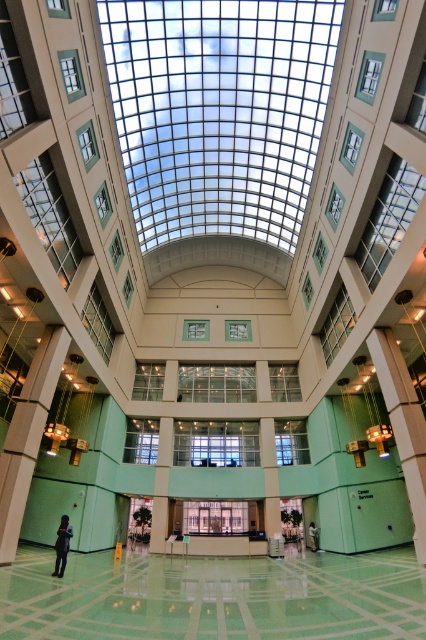
Question: Which of the following is the closest to the observer?

Choices:
 (A) (55, 541)
 (B) (313, 536)
 (C) (40, 552)

Answer: (C)

Question: Is green polished concrete floor at lower center to the right of light brown leather jacket at lower center from the viewer's perspective?

Choices:
 (A) yes
 (B) no

Answer: (B)

Question: Among these points, which one is nearest to the camera?

Choices:
 (A) pyautogui.click(x=62, y=545)
 (B) pyautogui.click(x=235, y=600)

Answer: (B)

Question: Can you confirm if green polished concrete floor at lower center is thinner than light brown leather jacket at lower center?

Choices:
 (A) yes
 (B) no

Answer: (B)

Question: Among these objects, which one is nearest to the camera?

Choices:
 (A) green polished concrete floor at lower center
 (B) dark blue jeans at lower left

Answer: (A)

Question: Can you confirm if green polished concrete floor at lower center is smaller than dark blue jeans at lower left?

Choices:
 (A) no
 (B) yes

Answer: (A)